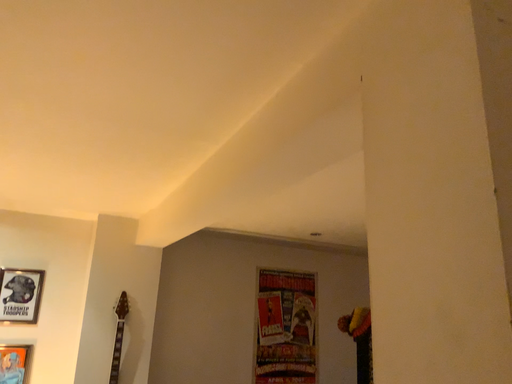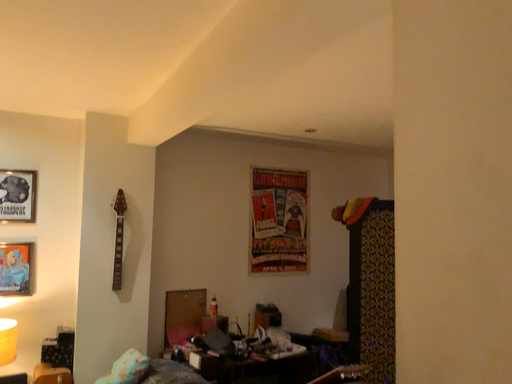
Question: Which way did the camera rotate in the video?

Choices:
 (A) rotated downward
 (B) rotated upward

Answer: (A)